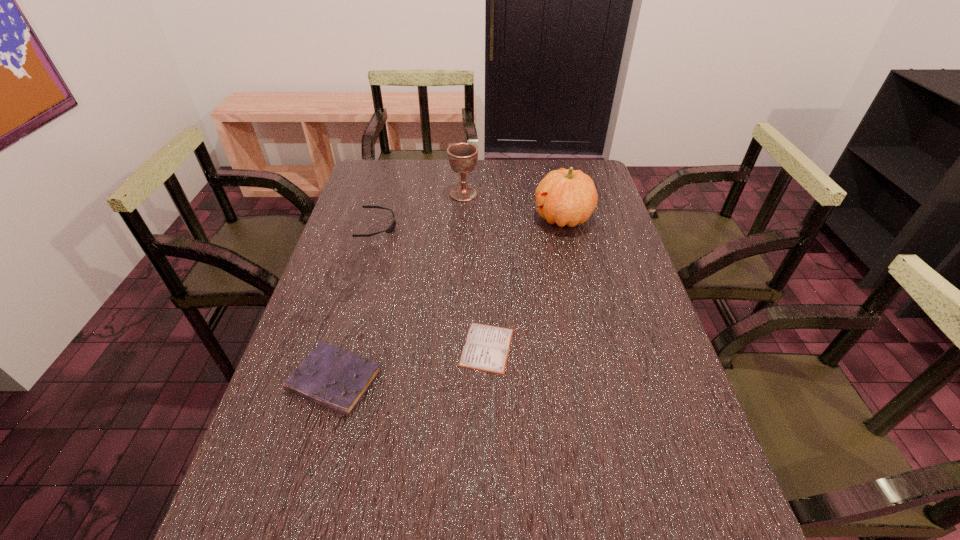
The width and height of the screenshot is (960, 540). In order to click on vacant space at the right edge of the desktop in this screenshot , I will do `click(690, 411)`.

The image size is (960, 540). In the image, there is a desktop. What are the coordinates of `free region at the far left corner` in the screenshot? It's located at (376, 171).

The image size is (960, 540). Find the location of `free space between the shortest object and the farthest object`. free space between the shortest object and the farthest object is located at coordinates (475, 271).

This screenshot has height=540, width=960. What are the coordinates of `free point between the sunglasses and the rightmost object` in the screenshot? It's located at (470, 222).

At what (x,y) coordinates should I click in order to perform the action: click on vacant space in between the sunglasses and the shorter diary. Please return your answer as a coordinate pair (x, y). This screenshot has width=960, height=540. Looking at the image, I should click on (432, 287).

Where is `vacant space in between the rightmost object and the chalice`? The height and width of the screenshot is (540, 960). vacant space in between the rightmost object and the chalice is located at coordinates (514, 206).

Where is `free point between the chalice and the right diary`? free point between the chalice and the right diary is located at coordinates (475, 271).

I want to click on vacant point located between the pumpkin and the sunglasses, so click(x=470, y=222).

This screenshot has width=960, height=540. In order to click on vacant point located between the sunglasses and the shorter diary in this screenshot , I will do `click(432, 287)`.

Image resolution: width=960 pixels, height=540 pixels. Find the location of `vacant space that is in between the left diary and the sunglasses`. vacant space that is in between the left diary and the sunglasses is located at coordinates (356, 303).